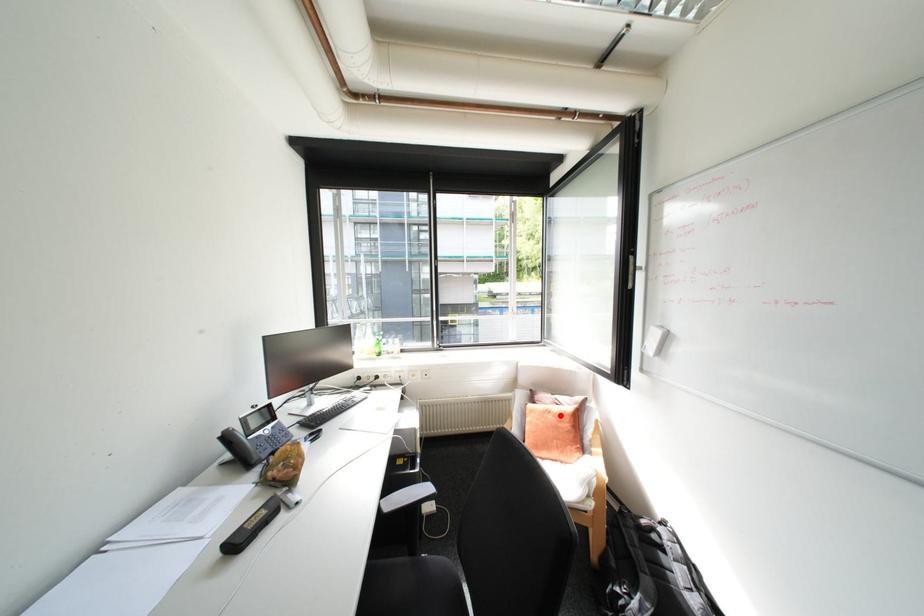
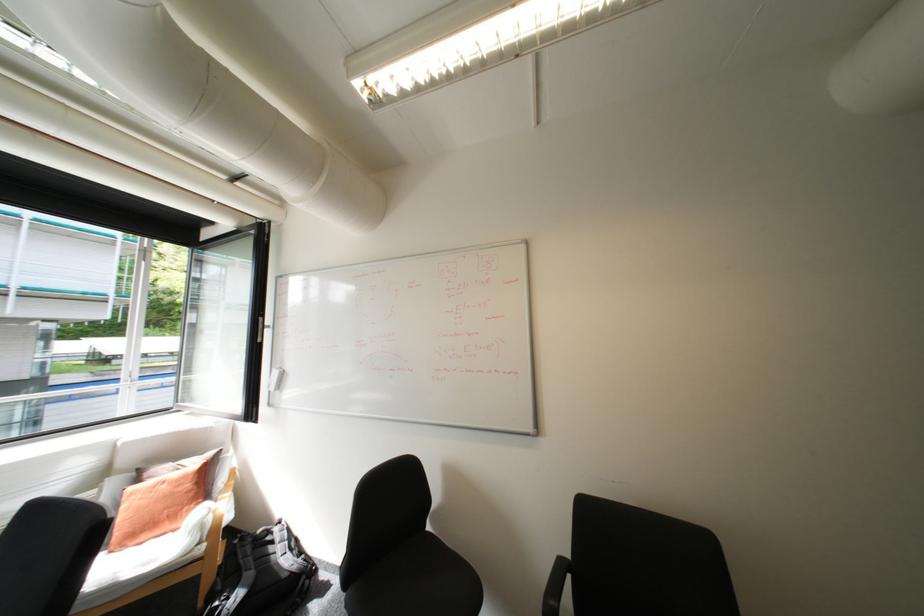
Question: A red point is marked in image1. In image2, is the corresponding 3D point closer to the camera or farther? Reply with the corresponding letter.

Choices:
 (A) The corresponding 3D point is closer.
 (B) The corresponding 3D point is farther.

Answer: (A)